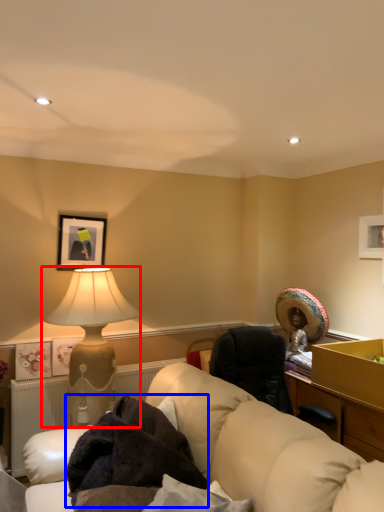
Question: Which of the following is the farthest to the observer, lamp (highlighted by a red box) or blanket (highlighted by a blue box)?

Choices:
 (A) lamp
 (B) blanket

Answer: (A)